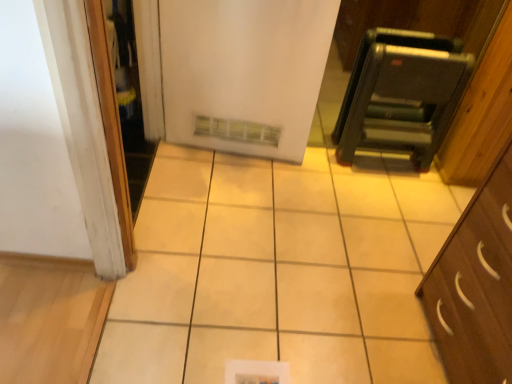
Identify the location of vacant space in between white matte refrigerator at center and white glossy screen door at left. Image resolution: width=512 pixels, height=384 pixels. (198, 188).